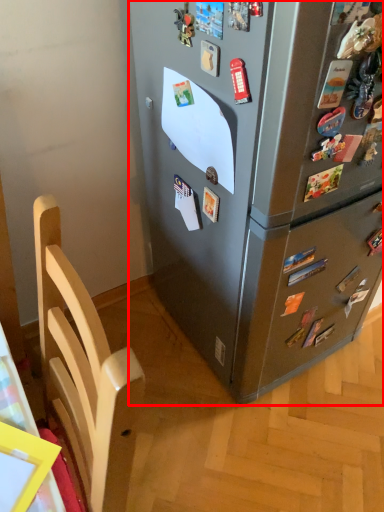
Question: From the image's perspective, what is the correct spatial positioning of refrigerator (annotated by the red box) in reference to furniture?

Choices:
 (A) above
 (B) below

Answer: (A)